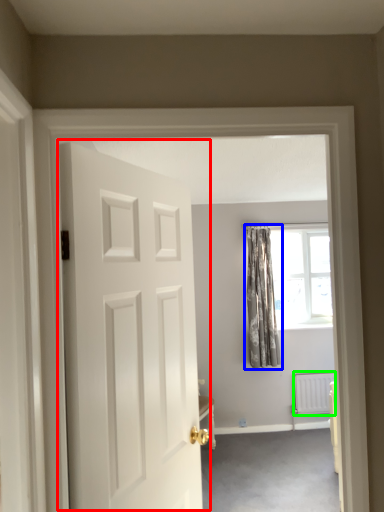
Question: Based on their relative distances, which object is nearer to door (highlighted by a red box)? Choose from curtain (highlighted by a blue box) and radiator (highlighted by a green box).

Choices:
 (A) curtain
 (B) radiator

Answer: (A)